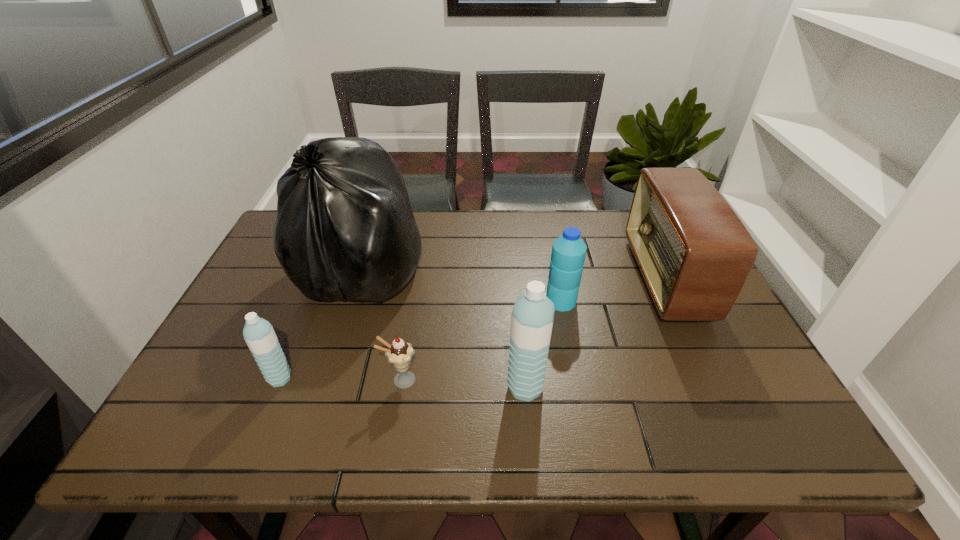
The height and width of the screenshot is (540, 960). In order to click on the leftmost water bottle in this screenshot , I will do `click(258, 333)`.

Locate an element on the screen. the fourth object from left to right is located at coordinates (532, 317).

I want to click on the second water bottle from left to right, so click(x=532, y=317).

Identify the location of the farthest water bottle. The image size is (960, 540). (568, 254).

In order to click on the rightmost water bottle in this screenshot , I will do `click(568, 254)`.

Find the location of `radio receiver`. radio receiver is located at coordinates (695, 254).

This screenshot has width=960, height=540. In order to click on the tallest object in this screenshot , I will do `click(345, 229)`.

Locate an element on the screen. icecream is located at coordinates (399, 353).

I want to click on free space located 0.150m on the back of the leftmost water bottle, so click(x=303, y=321).

This screenshot has width=960, height=540. I want to click on vacant space located 0.140m on the left of the second water bottle from left to right, so pos(444,387).